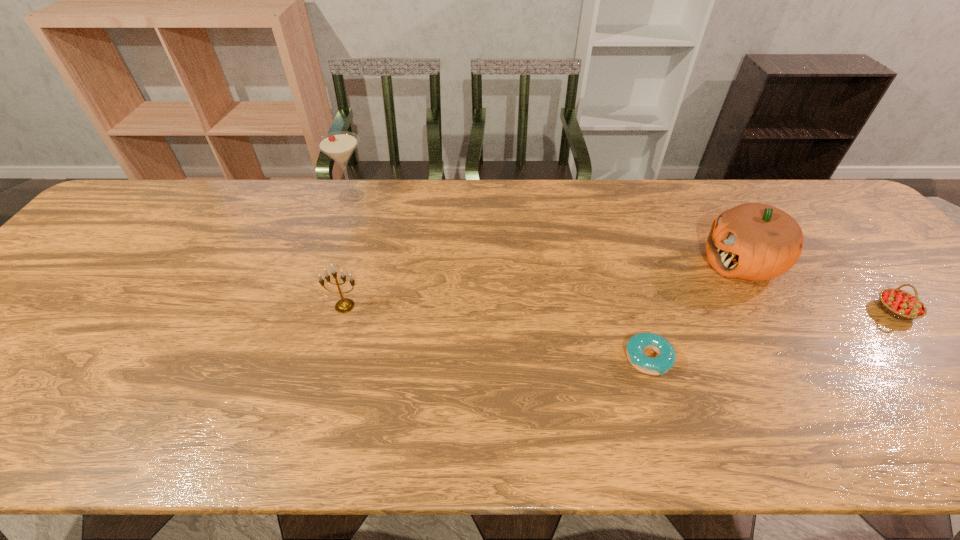
Locate an element on the screen. This screenshot has height=540, width=960. free space located 0.300m on the face of the second object from right to left is located at coordinates (590, 262).

Where is `free point located on the face of the second object from right to left`? free point located on the face of the second object from right to left is located at coordinates (568, 262).

Where is `free space located on the back of the third shortest object`? The image size is (960, 540). free space located on the back of the third shortest object is located at coordinates (358, 257).

Locate an element on the screen. This screenshot has height=540, width=960. free space located on the right of the strawberry is located at coordinates (940, 310).

Find the location of a particular element. The height and width of the screenshot is (540, 960). vacant point located on the back of the third object from left to right is located at coordinates (611, 237).

Locate an element on the screen. The height and width of the screenshot is (540, 960). object positioned at the far edge is located at coordinates point(340,145).

The height and width of the screenshot is (540, 960). Identify the location of object located at the right edge. (900, 304).

The image size is (960, 540). In order to click on free space at the far edge of the desktop in this screenshot , I will do `click(640, 213)`.

I want to click on vacant space at the near edge of the desktop, so click(428, 449).

Locate an element on the screen. The image size is (960, 540). vacant region at the left edge is located at coordinates (84, 291).